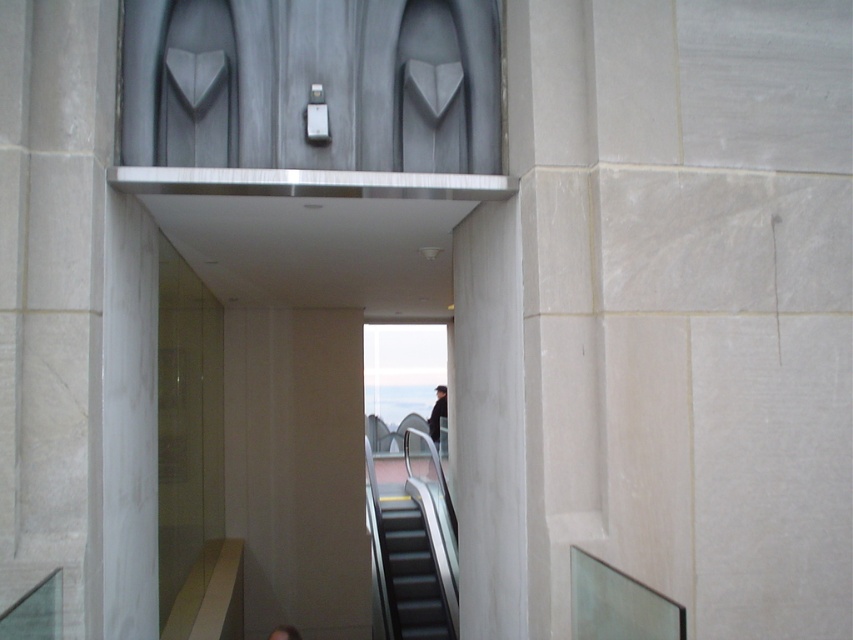
Is the position of black rubber escalator at center less distant than that of black matte jacket at center?

Yes, it is in front of black matte jacket at center.

Who is more forward, (x=421, y=632) or (x=444, y=406)?

Point (x=421, y=632) is in front.

Is point (431, 612) more distant than point (442, 412)?

No.

You are a GUI agent. You are given a task and a screenshot of the screen. Output one action in this format:
    pyautogui.click(x=<x>, y=<y>)
    Task: Click on the black rubber escalator at center
    
    Given the screenshot: What is the action you would take?
    pyautogui.click(x=410, y=573)